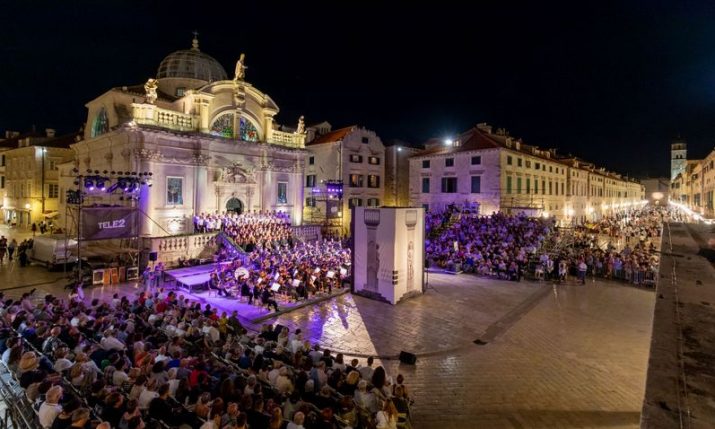
Image resolution: width=715 pixels, height=429 pixels. I want to click on rectangular pillar, so click(x=392, y=255).